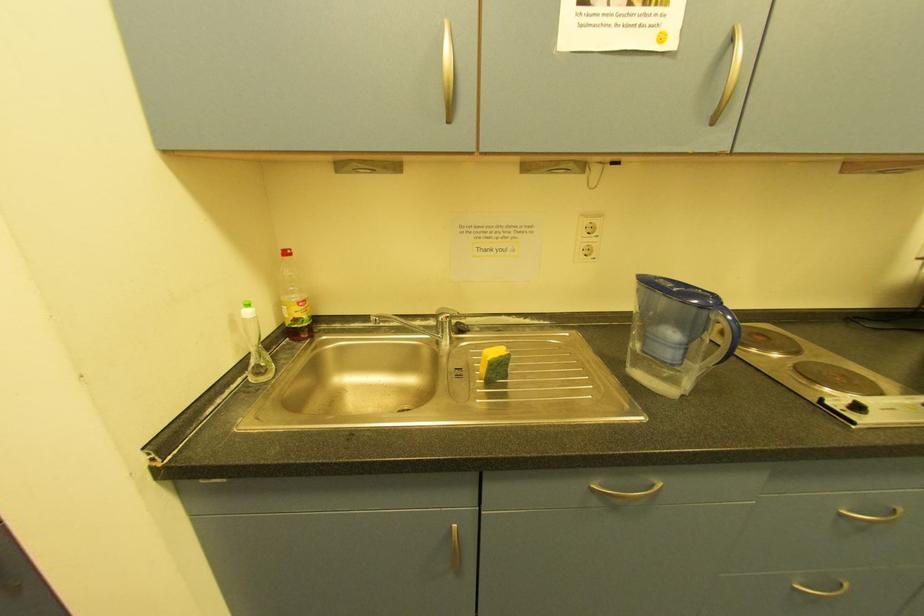
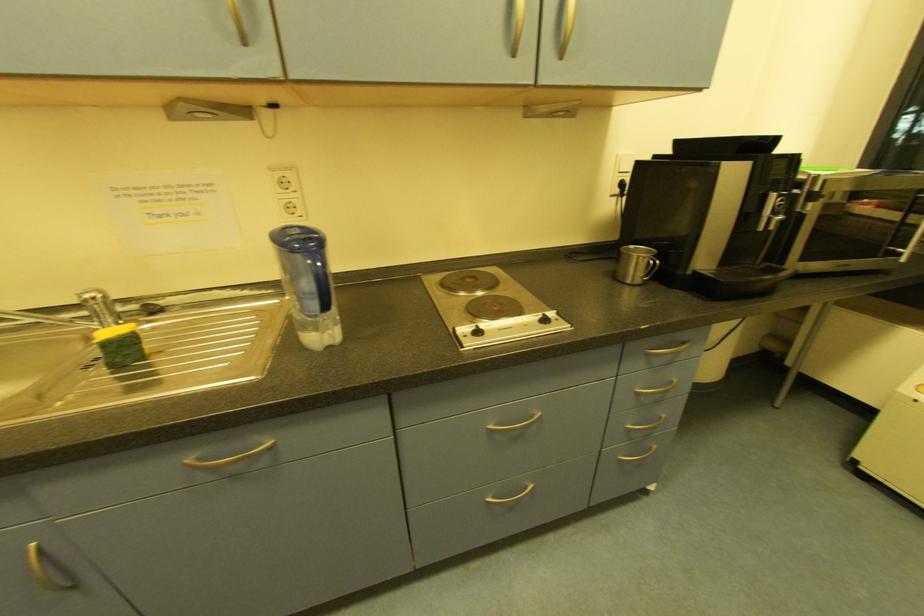
Question: The camera is either moving clockwise (left) or counter-clockwise (right) around the object. The first image is from the beginning of the video and the second image is from the end. Is the camera moving left or right when shooting the video?

Choices:
 (A) Left
 (B) Right

Answer: (A)